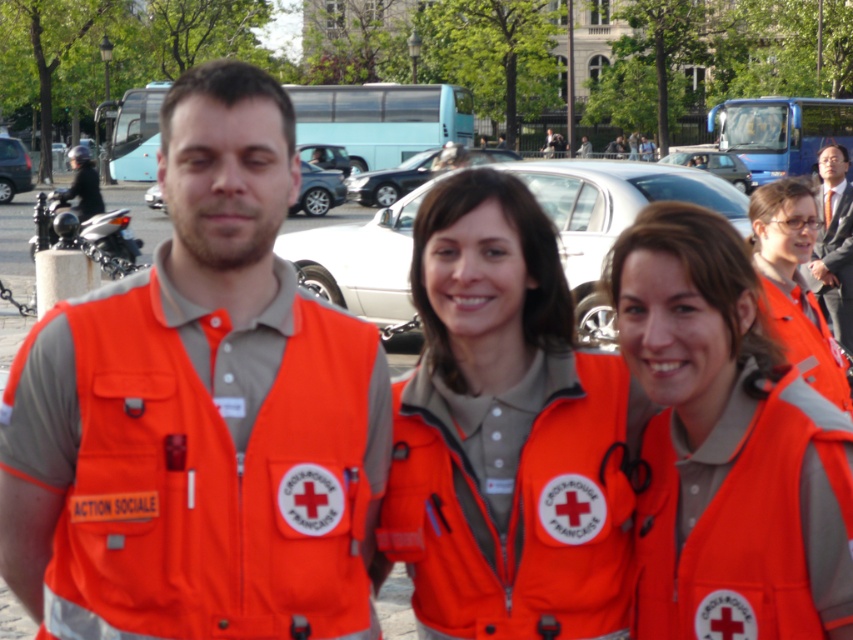
Is point (306, 465) less distant than point (384, 497)?

That is True.

This screenshot has height=640, width=853. I want to click on orange fabric vest at left, so click(x=200, y=413).

Identify the location of orange fabric vest at left. Image resolution: width=853 pixels, height=640 pixels. (200, 413).

This screenshot has width=853, height=640. I want to click on orange fabric vest at left, so click(200, 413).

Which is below, orange softshell jacket at center or orange fabric vest at center?

Positioned lower is orange softshell jacket at center.

Which is more to the right, orange softshell jacket at center or orange fabric vest at center?

orange fabric vest at center is more to the right.

Does point (553, 554) come closer to viewer compared to point (781, 225)?

Yes, point (553, 554) is in front of point (781, 225).

The width and height of the screenshot is (853, 640). I want to click on orange softshell jacket at center, so click(503, 433).

Can you confirm if orange fabric vest at left is shorter than orange fabric vest at center?

No.

Where is `orange fabric vest at left`? orange fabric vest at left is located at coordinates (200, 413).

Who is more distant from viewer, (202, 588) or (778, 280)?

The point (778, 280) is more distant.

This screenshot has width=853, height=640. What are the coordinates of `orange fabric vest at left` in the screenshot? It's located at (200, 413).